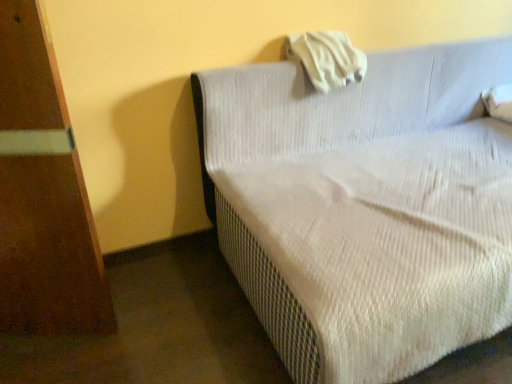
Question: Is white fabric pillow at upper center taller or shorter than white textured fabric couch at center?

Choices:
 (A) tall
 (B) short

Answer: (B)

Question: Does point (317, 51) appear closer or farther from the camera than point (321, 100)?

Choices:
 (A) closer
 (B) farther

Answer: (A)

Question: Is white fabric pillow at upper center to the left or to the right of white textured fabric couch at center in the image?

Choices:
 (A) right
 (B) left

Answer: (B)

Question: Considering the relative positions of white textured fabric couch at center and white fabric pillow at upper center in the image provided, is white textured fabric couch at center to the left or to the right of white fabric pillow at upper center?

Choices:
 (A) left
 (B) right

Answer: (B)

Question: Is white textured fabric couch at center wider or thinner than white fabric pillow at upper center?

Choices:
 (A) thin
 (B) wide

Answer: (B)

Question: In terms of height, does white textured fabric couch at center look taller or shorter compared to white fabric pillow at upper center?

Choices:
 (A) tall
 (B) short

Answer: (A)

Question: Relative to white fabric pillow at upper center, is white textured fabric couch at center in front or behind?

Choices:
 (A) behind
 (B) front

Answer: (B)